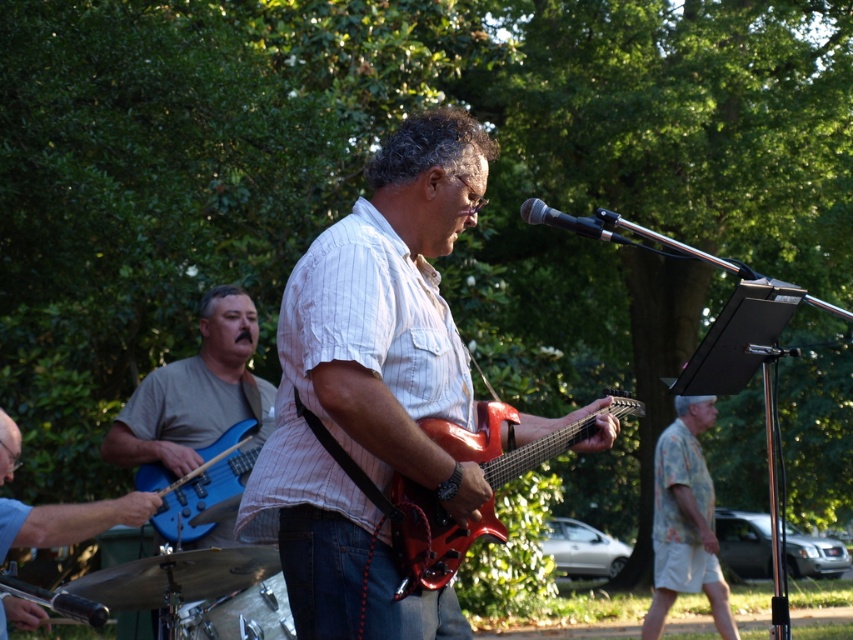
Question: Which object is the closest to the matte blue guitar at left?

Choices:
 (A) glossy red electric guitar at center
 (B) floral print shirt at center
 (C) black matte microphone at upper center
 (D) matte white shirt at center

Answer: (C)

Question: Which object is farther from the camera taking this photo?

Choices:
 (A) black matte microphone at upper center
 (B) glossy red electric guitar at center
 (C) brushed metal bass guitar at left
 (D) brushed metal bass at left

Answer: (A)

Question: Which point appears closest to the camera in this image?

Choices:
 (A) (244, 328)
 (B) (498, 458)

Answer: (B)

Question: Is matte blue guitar at left thinner than black matte microphone at upper center?

Choices:
 (A) no
 (B) yes

Answer: (A)

Question: Where is floral print shirt at center located in relation to brushed metal bass at left in the image?

Choices:
 (A) below
 (B) above

Answer: (A)

Question: Can you confirm if matte white shirt at center is bigger than brushed metal bass guitar at left?

Choices:
 (A) yes
 (B) no

Answer: (A)